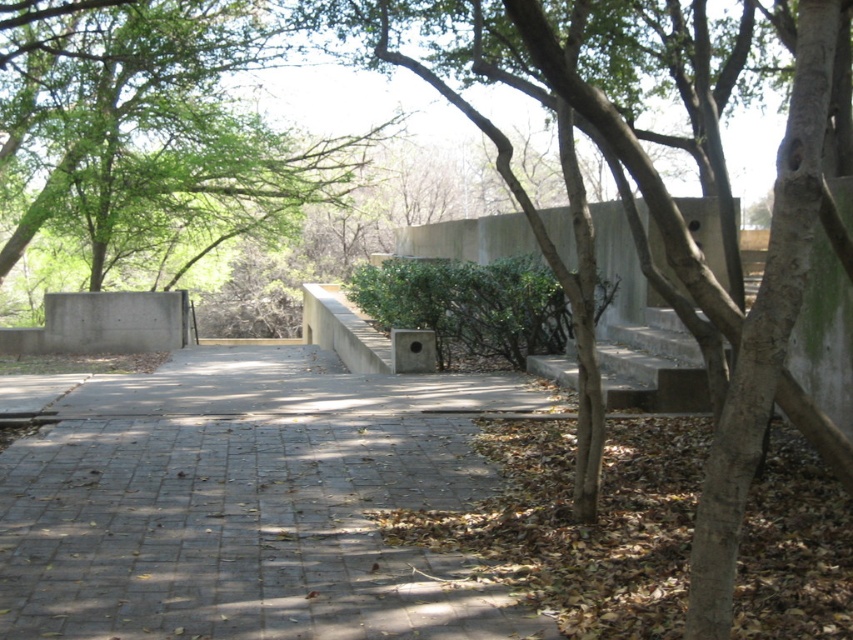
In the scene shown: How distant is gray concrete pavement at center from green matte hedge at center?

The distance of gray concrete pavement at center from green matte hedge at center is 3.99 meters.

Can you confirm if gray concrete pavement at center is bigger than green matte hedge at center?

Incorrect, gray concrete pavement at center is not larger than green matte hedge at center.

Between point (216, 400) and point (430, 294), which one is positioned behind?

Point (430, 294)

At what (x,y) coordinates should I click in order to perform the action: click on gray concrete pavement at center. Please return your answer as a coordinate pair (x, y). The height and width of the screenshot is (640, 853). Looking at the image, I should click on (248, 502).

Is point (122, 147) in front of point (485, 282)?

No.

Is green leafy tree at center taller than green matte hedge at center?

Yes, green leafy tree at center is taller than green matte hedge at center.

You are a GUI agent. You are given a task and a screenshot of the screen. Output one action in this format:
    pyautogui.click(x=<x>, y=<y>)
    Task: Click on the green leafy tree at center
    The image size is (853, 640).
    Given the screenshot: What is the action you would take?
    pyautogui.click(x=151, y=140)

This screenshot has width=853, height=640. What do you see at coordinates (248, 502) in the screenshot?
I see `gray concrete pavement at center` at bounding box center [248, 502].

Can you confirm if gray concrete pavement at center is smaller than green leafy tree at center?

Correct, gray concrete pavement at center occupies less space than green leafy tree at center.

Which is behind, point (78, 442) or point (97, 243)?

Positioned behind is point (97, 243).

Locate an element on the screen. The width and height of the screenshot is (853, 640). gray concrete pavement at center is located at coordinates (248, 502).